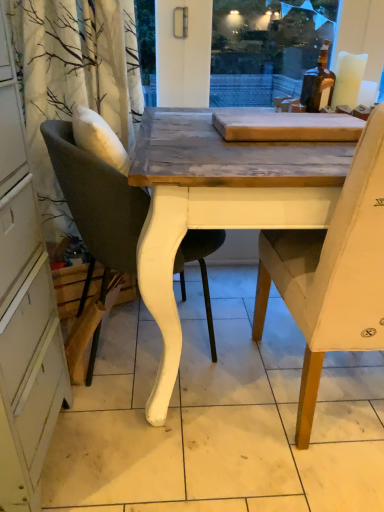
Where is `free region on the left part of light beige fabric chair at right, which appears as the 2th chair when viewed from the left`? This screenshot has height=512, width=384. free region on the left part of light beige fabric chair at right, which appears as the 2th chair when viewed from the left is located at coordinates (187, 426).